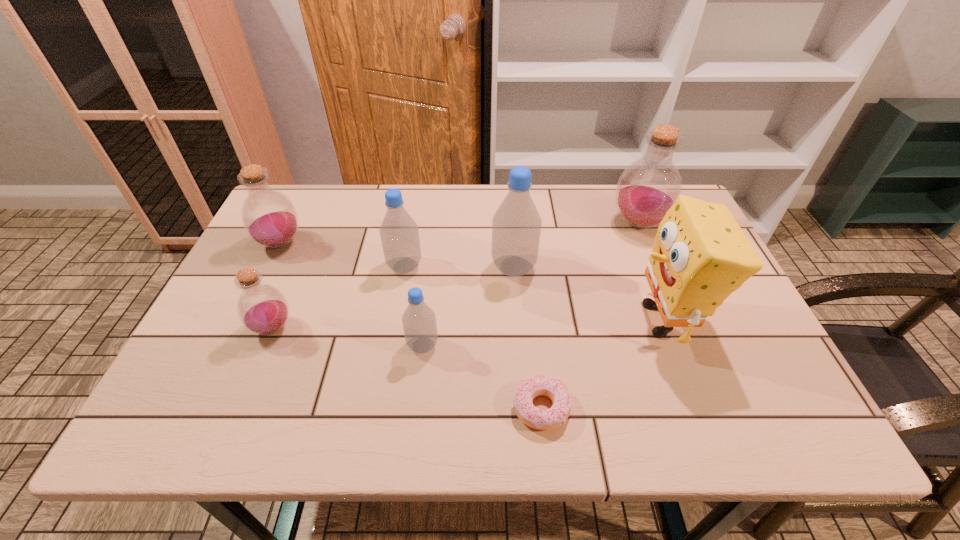
The image size is (960, 540). I want to click on doughnut, so click(555, 389).

What are the coordinates of `vacant space located 0.290m on the left of the rightmost bottle` in the screenshot? It's located at (512, 224).

Locate an element on the screen. This screenshot has height=540, width=960. vacant space located on the front of the fifth bottle from left to right is located at coordinates (518, 326).

Identify the location of vacant region located 0.390m on the face of the sponge. (466, 320).

Identify the location of vacant position located 0.120m on the face of the sponge. (578, 320).

Where is `vacant space located 0.120m on the face of the sponge`? The height and width of the screenshot is (540, 960). vacant space located 0.120m on the face of the sponge is located at coordinates (578, 320).

At what (x,y) coordinates should I click in order to perform the action: click on blank area located 0.330m on the right of the second biggest purple bottle. Please return your answer as a coordinate pair (x, y). Image resolution: width=960 pixels, height=540 pixels. Looking at the image, I should click on (421, 243).

This screenshot has height=540, width=960. I want to click on free location located 0.380m on the right of the second biggest gray bottle, so click(564, 266).

Where is `vacant space situated 0.390m on the right of the smallest purple bottle`? The width and height of the screenshot is (960, 540). vacant space situated 0.390m on the right of the smallest purple bottle is located at coordinates (461, 328).

You are a GUI agent. You are given a task and a screenshot of the screen. Output one action in this format:
    pyautogui.click(x=<x>, y=<y>)
    Task: Click on the vacant space located 0.200m on the right of the nearest gray bottle
    The image size is (960, 540).
    Given the screenshot: What is the action you would take?
    pyautogui.click(x=527, y=345)